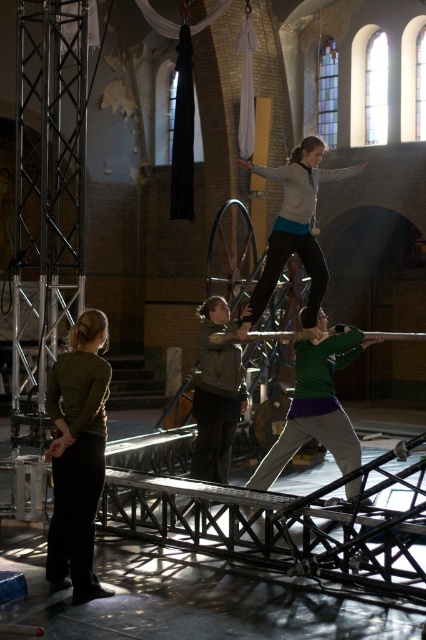
Does matte olive green sweater at lower left appear on the right side of dark brown leather jacket at center?

No, matte olive green sweater at lower left is not to the right of dark brown leather jacket at center.

Between matte olive green sweater at lower left and dark brown leather jacket at center, which one is positioned higher?

dark brown leather jacket at center is higher up.

The image size is (426, 640). I want to click on matte olive green sweater at lower left, so click(77, 456).

This screenshot has width=426, height=640. I want to click on matte olive green sweater at lower left, so click(77, 456).

Is gray sweater at center behind dark brown leather jacket at center?

No, gray sweater at center is closer to the viewer.

Measure the distance between gray sweater at center and camera.

gray sweater at center is 12.51 meters from camera.

Between point (313, 298) and point (241, 385), which one is positioned in front?

Point (313, 298) is in front.

Where is `gray sweater at center`? gray sweater at center is located at coordinates (293, 227).

Based on the photo, who is positioned more to the right, matte olive green sweater at lower left or green matte shirt at center?

green matte shirt at center is more to the right.

Can you confirm if matte olive green sweater at lower left is bigger than green matte shirt at center?

No, matte olive green sweater at lower left is not bigger than green matte shirt at center.

Which is in front, point (72, 492) or point (319, 348)?

Point (72, 492) is in front.

Where is `matte olive green sweater at lower left`? The width and height of the screenshot is (426, 640). matte olive green sweater at lower left is located at coordinates (77, 456).